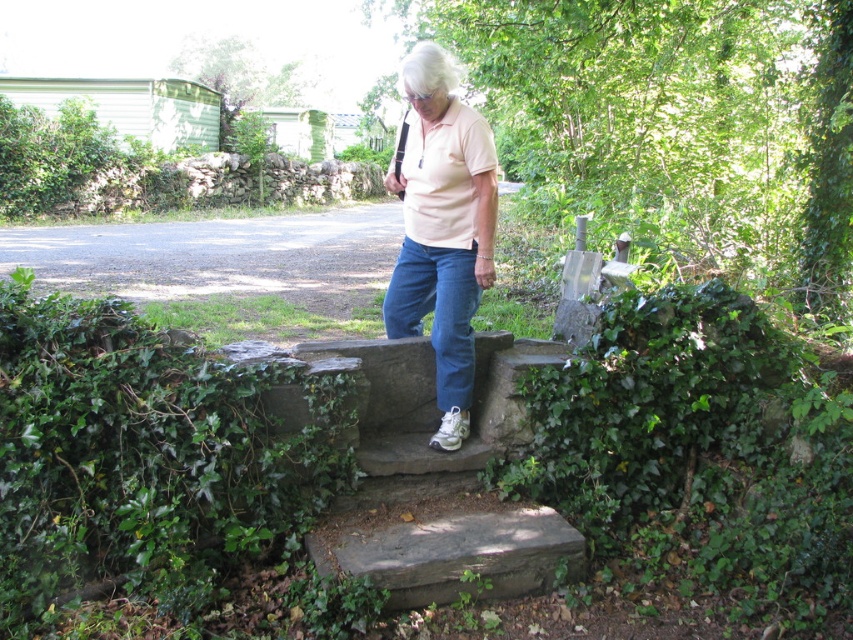
Question: Which point is closer to the camera taking this photo?

Choices:
 (A) (465, 573)
 (B) (445, 221)

Answer: (A)

Question: Is stone steps at center further to the viewer compared to pink cotton shirt at center?

Choices:
 (A) yes
 (B) no

Answer: (B)

Question: Which point is farther from the camera taking this photo?

Choices:
 (A) pyautogui.click(x=422, y=186)
 (B) pyautogui.click(x=514, y=344)

Answer: (B)

Question: Does stone steps at center have a lesser width compared to pink cotton shirt at center?

Choices:
 (A) no
 (B) yes

Answer: (A)

Question: Which point is farther to the camera?

Choices:
 (A) (374, 561)
 (B) (434, 444)

Answer: (B)

Question: Is stone steps at center bigger than pink cotton shirt at center?

Choices:
 (A) yes
 (B) no

Answer: (A)